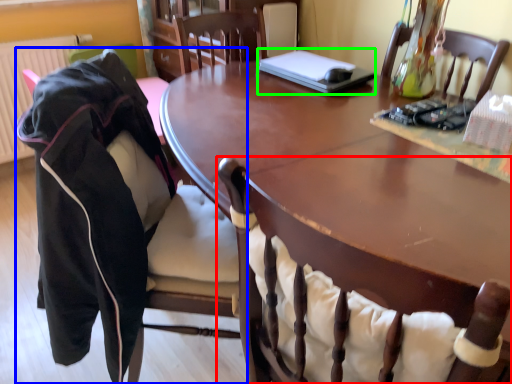
Question: Estimate the real-world distances between objects in this image. Which object is farther from chair (highlighted by a red box), chair (highlighted by a blue box) or laptop (highlighted by a green box)?

Choices:
 (A) chair
 (B) laptop

Answer: (B)